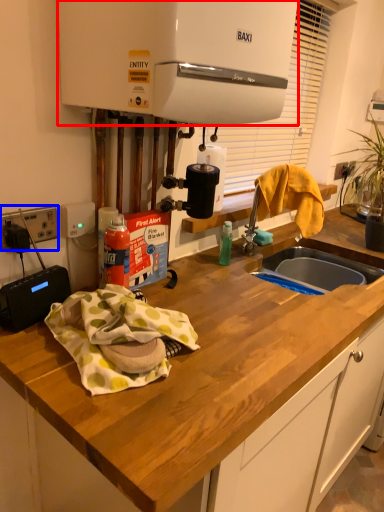
Question: Which of the following is the closest to the observer, home appliance (highlighted by a red box) or electric outlet (highlighted by a blue box)?

Choices:
 (A) home appliance
 (B) electric outlet

Answer: (A)